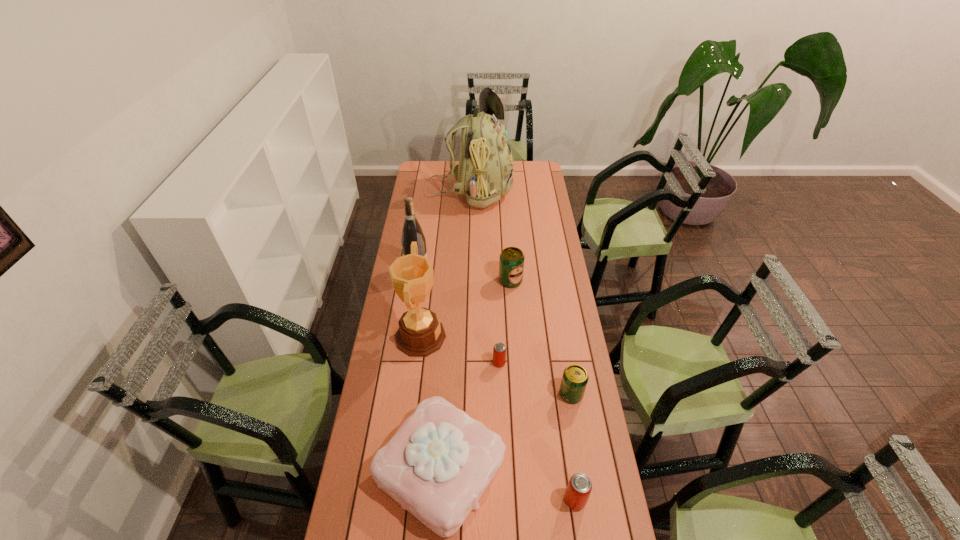
You are a GUI agent. You are given a task and a screenshot of the screen. Output one action in this format:
    pyautogui.click(x=<x>, y=<y>)
    Task: Click on the backpack that is positioned at the left edge
    This screenshot has width=960, height=540.
    Given the screenshot: What is the action you would take?
    pyautogui.click(x=485, y=171)

Find the location of `wine bottle positioned at the left edge`. wine bottle positioned at the left edge is located at coordinates (412, 232).

Locate an element on the screen. award that is at the left edge is located at coordinates (420, 333).

Where is `object at the far left corner`? object at the far left corner is located at coordinates (485, 171).

The height and width of the screenshot is (540, 960). In the image, there is a desktop. In order to click on free space at the left edge in this screenshot , I will do `click(420, 193)`.

Image resolution: width=960 pixels, height=540 pixels. I want to click on vacant space at the right edge, so click(594, 469).

Locate an element on the screen. vacant space at the far left corner is located at coordinates (418, 165).

Locate an element on the screen. Image resolution: width=960 pixels, height=540 pixels. vacant space at the far right corner of the desktop is located at coordinates (532, 163).

The image size is (960, 540). Find the location of `vacant area that lies between the left pink beer can and the nearer green beer can`. vacant area that lies between the left pink beer can and the nearer green beer can is located at coordinates coord(535,379).

The image size is (960, 540). Identify the location of free area in between the backpack and the farther pink beer can. (485, 278).